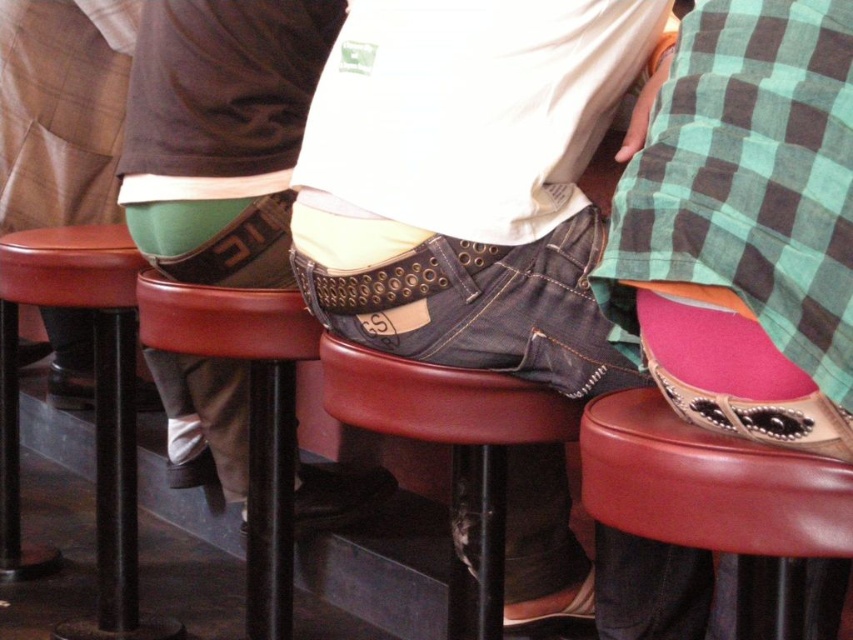
Does leather seat at lower left come in front of smooth leather bar stool at center?

No, leather seat at lower left is further to the viewer.

Is leather seat at lower left smaller than smooth leather bar stool at center?

No, leather seat at lower left is not smaller than smooth leather bar stool at center.

Who is more distant from viewer, (x=108, y=618) or (x=486, y=627)?

Point (x=108, y=618)

This screenshot has width=853, height=640. Identify the location of leather seat at lower left. (94, 397).

Can you confirm if leather at center is wider than leather seat at lower left?

In fact, leather at center might be narrower than leather seat at lower left.

Is leather at center to the right of leather seat at lower left from the viewer's perspective?

Yes, leather at center is to the right of leather seat at lower left.

What do you see at coordinates (708, 484) in the screenshot?
I see `leather at center` at bounding box center [708, 484].

The width and height of the screenshot is (853, 640). Identify the location of leather at center. (708, 484).

Who is higher up, jeans at center or smooth leather bar stool at center?

Positioned higher is jeans at center.

Between point (682, 616) and point (408, 380), which one is positioned in front?

Point (408, 380) is more forward.

The image size is (853, 640). Identify the location of jeans at center. (467, 180).